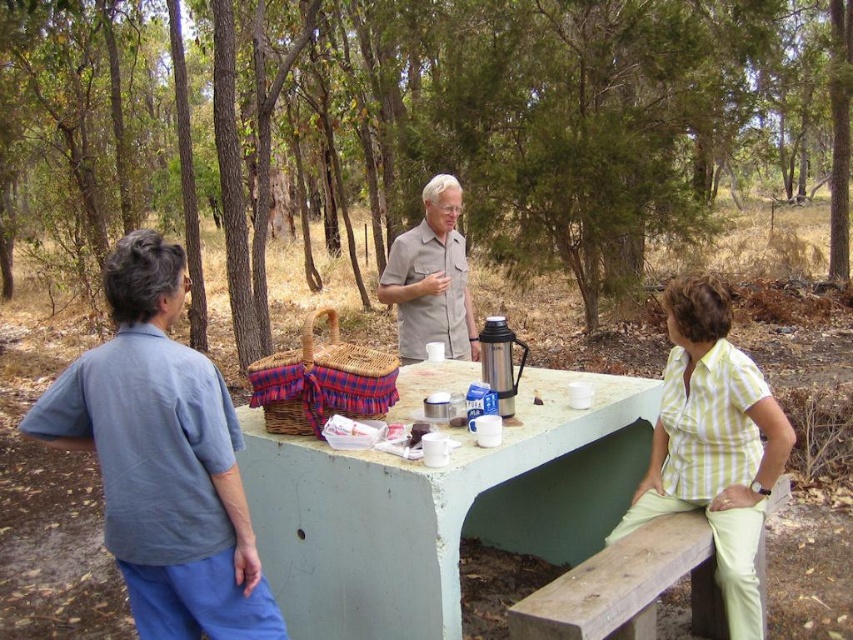
What is the color of the shirt worn by the person located at the coordinates point (161, 458)?

The person at point (161, 458) is wearing a blue cotton shirt.

Based on the photo, you are planning to place a new decorative item on the picnic table between the blue cotton shirt at upper left and the plaid fabric picnic basket at center. Based on their current positions, which side of the picnic basket should you place it to ensure it is between them?

The blue cotton shirt at upper left is positioned on the right side of the plaid fabric picnic basket at center. To place the decorative item between them, it should be placed to the left side of the plaid fabric picnic basket at center, between the two objects.